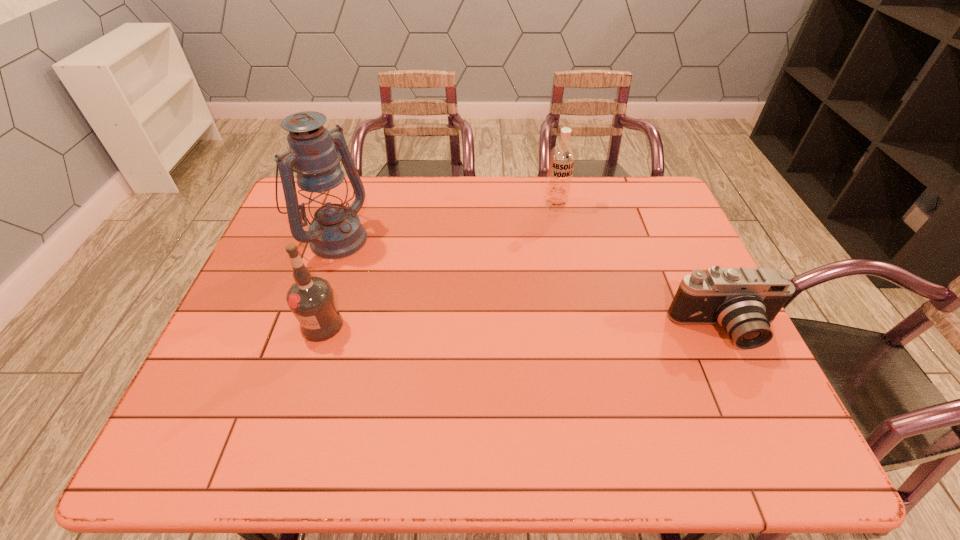
Where is `vacant space at the far edge of the desktop`? vacant space at the far edge of the desktop is located at coordinates (428, 205).

This screenshot has width=960, height=540. I want to click on blank area at the near edge, so pos(539,399).

Identify the location of vacant space at the left edge. (271, 316).

Image resolution: width=960 pixels, height=540 pixels. Find the location of `free space at the right edge`. free space at the right edge is located at coordinates (706, 350).

Find the location of a particular element. Image resolution: width=960 pixels, height=540 pixels. empty space that is in between the lantern and the farther vodka is located at coordinates (444, 221).

The image size is (960, 540). Find the location of `vacant area that lies between the left vodka and the farther vodka`. vacant area that lies between the left vodka and the farther vodka is located at coordinates (439, 265).

Where is `free space between the left vodka and the farther vodka`? Image resolution: width=960 pixels, height=540 pixels. free space between the left vodka and the farther vodka is located at coordinates (439, 265).

Find the location of a particular element. The image size is (960, 540). vacant region between the camera and the third object from left to right is located at coordinates (640, 268).

What are the coordinates of `free point between the right vodka and the shortest object` in the screenshot? It's located at (640, 268).

Identify the location of free space between the tallest object and the farthest object. Image resolution: width=960 pixels, height=540 pixels. (444, 221).